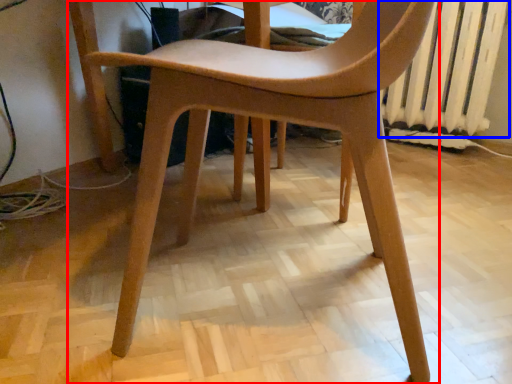
Question: Among these objects, which one is farthest to the camera, chair (highlighted by a red box) or radiator (highlighted by a blue box)?

Choices:
 (A) chair
 (B) radiator

Answer: (B)